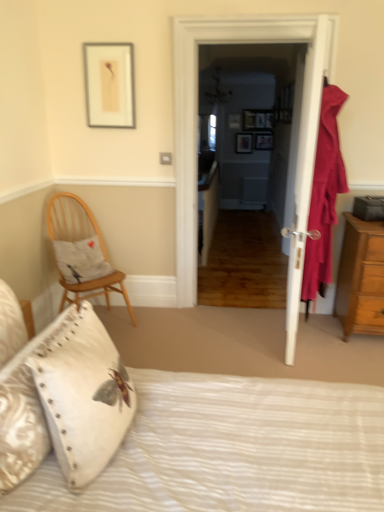
What is the approximate height of matte wooden picture frame at upper center, the 5th picture frame in the bottom-to-top sequence?

It is 32.72 centimeters.

This screenshot has height=512, width=384. What do you see at coordinates (196, 126) in the screenshot? I see `white wooden door at center` at bounding box center [196, 126].

Describe the element at coordinates (84, 397) in the screenshot. The image size is (384, 512). I see `velvet beige pillow at lower left, which is the 2th pillow in front-to-back order` at that location.

Find the location of a particular element. wooden chair with cushion at left is located at coordinates (81, 252).

Image resolution: width=384 pixels, height=512 pixels. What do you see at coordinates (324, 196) in the screenshot?
I see `velvet red curtain at right` at bounding box center [324, 196].

Where is `matte wooden picture frame at upper center, placed as the third picture frame when sorted from front to back`? Image resolution: width=384 pixels, height=512 pixels. matte wooden picture frame at upper center, placed as the third picture frame when sorted from front to back is located at coordinates (234, 121).

Between wooden chair with cushion at left and velvet red curtain at right, which one has less height?

With less height is wooden chair with cushion at left.

Considering their positions, is wooden chair with cushion at left located in front of or behind velvet red curtain at right?

wooden chair with cushion at left is behind velvet red curtain at right.

Is wooden chair with cushion at left surrounding velvet red curtain at right?

No, wooden chair with cushion at left does not contain velvet red curtain at right.

Does wooden chair with cushion at left turn towards velvet red curtain at right?

No, wooden chair with cushion at left is not oriented towards velvet red curtain at right.

Looking at this image, considering the positions of objects matte paper picture frame at upper left, the fifth picture frame viewed from the top, and white wooden door at center in the image provided, who is in front, matte paper picture frame at upper left, the fifth picture frame viewed from the top, or white wooden door at center?

white wooden door at center is closer to the camera.

Can you confirm if matte paper picture frame at upper left, which ranks as the first picture frame in bottom-to-top order, is wider than white wooden door at center?

No.

Is matte paper picture frame at upper left, which is the fifth picture frame in right-to-left order, facing away from white wooden door at center?

No, matte paper picture frame at upper left, which is the fifth picture frame in right-to-left order, is not facing the opposite direction of white wooden door at center.

From the image's perspective, which one is positioned higher, matte paper picture frame at upper left, the fifth picture frame viewed from the top, or white wooden door at center?

matte paper picture frame at upper left, the fifth picture frame viewed from the top.

Is white textured pillow at lower left, which appears as the third pillow when viewed from the back, positioned beyond the bounds of velvet red curtain at right?

white textured pillow at lower left, which appears as the third pillow when viewed from the back, is positioned outside velvet red curtain at right.

Does white textured pillow at lower left, the first pillow from the front, have a lesser height compared to velvet red curtain at right?

Yes, white textured pillow at lower left, the first pillow from the front, is shorter than velvet red curtain at right.

Is white textured pillow at lower left, the first pillow from the front, positioned with its back to velvet red curtain at right?

No, white textured pillow at lower left, the first pillow from the front,'s orientation is not away from velvet red curtain at right.

Is point (10, 384) positioned in front of point (322, 190)?

Yes, it is in front of point (322, 190).

Looking at their sizes, would you say white textured pillow at lower left, which appears as the third pillow when viewed from the back, is wider or thinner than matte paper picture frame at upper left, acting as the 1th picture frame starting from the left?

In the image, white textured pillow at lower left, which appears as the third pillow when viewed from the back, appears to be wider than matte paper picture frame at upper left, acting as the 1th picture frame starting from the left.

From a real-world perspective, is white textured pillow at lower left, the first pillow from the front, above or below matte paper picture frame at upper left, the first picture frame when ordered from front to back?

In terms of real-world spatial position, white textured pillow at lower left, the first pillow from the front, is below matte paper picture frame at upper left, the first picture frame when ordered from front to back.

The height and width of the screenshot is (512, 384). I want to click on the 2nd pillow directly beneath the matte paper picture frame at upper left, the first picture frame when ordered from front to back (from a real-world perspective), so click(x=25, y=409).

Is white textured pillow at lower left, the first pillow from the front, at the left side of matte paper picture frame at upper left, the fifth picture frame viewed from the top?

In fact, white textured pillow at lower left, the first pillow from the front, is to the right of matte paper picture frame at upper left, the fifth picture frame viewed from the top.

Looking at this image, which object is positioned more to the right, brown wooden chest of drawers at right or wooden picture frame at center, the first picture frame in the back-to-front sequence?

brown wooden chest of drawers at right.

Which is closer, (372, 248) or (239, 147)?

Point (372, 248) is closer to the camera than point (239, 147).

In terms of width, does brown wooden chest of drawers at right look wider or thinner when compared to wooden picture frame at center, the fifth picture frame viewed from the front?

Clearly, brown wooden chest of drawers at right has more width compared to wooden picture frame at center, the fifth picture frame viewed from the front.

Is velvet red curtain at right oriented towards white wooden door at center?

No, velvet red curtain at right is not oriented towards white wooden door at center.

Locate an element on the screen. This screenshot has height=512, width=384. curtain in front of the white wooden door at center is located at coordinates (324, 196).

From the image's perspective, is velvet red curtain at right located above or below white wooden door at center?

Based on their image positions, velvet red curtain at right is located beneath white wooden door at center.

Does point (304, 262) come farther from viewer compared to point (331, 53)?

Yes.

Which object is wider, white textured pillow at lower left, the first pillow from the front, or white cotton pillow at left, which is the 3th pillow from front to back?

Wider between the two is white cotton pillow at left, which is the 3th pillow from front to back.

Could you tell me if white textured pillow at lower left, the first pillow from the front, is facing white cotton pillow at left, which is the 3th pillow from front to back?

No, white textured pillow at lower left, the first pillow from the front, does not turn towards white cotton pillow at left, which is the 3th pillow from front to back.

From a real-world perspective, does white textured pillow at lower left, which appears as the third pillow when viewed from the back, sit lower than white cotton pillow at left, which is the 1th pillow in back-to-front order?

No.

Based on their positions, is white textured pillow at lower left, the first pillow from the front, located to the left or right of white cotton pillow at left, which is the 3th pillow from front to back?

white textured pillow at lower left, the first pillow from the front, is positioned on white cotton pillow at left, which is the 3th pillow from front to back,'s right side.

Identify the location of chair behind the velvet red curtain at right. The width and height of the screenshot is (384, 512). (81, 252).

I want to click on the 1st picture frame above the white wooden door at center (from the image's perspective), so click(x=109, y=84).

When comparing their distances from wooden picture frame at center, positioned as the fourth picture frame in front-to-back order, does wooden chair with cushion at left or brown wooden chest of drawers at right seem closer?

Among the two, brown wooden chest of drawers at right is located nearer to wooden picture frame at center, positioned as the fourth picture frame in front-to-back order.

Which object lies nearer to the anchor point matte wooden picture frame at upper center, placed as the third picture frame when sorted from front to back, white wooden door at center or wooden picture frame at center, which is the 4th picture frame from top to bottom?

The object closer to matte wooden picture frame at upper center, placed as the third picture frame when sorted from front to back, is wooden picture frame at center, which is the 4th picture frame from top to bottom.

Looking at the image, which one is located closer to white wooden door at center, velvet beige pillow at lower left, which is the 2th pillow in front-to-back order, or white textured bed at lower center?

white textured bed at lower center is closer to white wooden door at center.

Based on their spatial positions, is matte wooden picture frame at upper center, the 5th picture frame in the bottom-to-top sequence, or wooden chair with cushion at left closer to velvet beige pillow at lower left, which is the 2th pillow in front-to-back order?

wooden chair with cushion at left is positioned closer to the anchor velvet beige pillow at lower left, which is the 2th pillow in front-to-back order.

Estimate the real-world distances between objects in this image. Which object is closer to brown wooden chest of drawers at right, white textured bed at lower center or white textured pillow at lower left, the first pillow from the front?

white textured bed at lower center.

Looking at the image, which one is located closer to velvet beige pillow at lower left, placed as the second pillow when sorted from back to front, white textured bed at lower center or white textured pillow at lower left, which appears as the third pillow when viewed from the back?

Based on the image, white textured pillow at lower left, which appears as the third pillow when viewed from the back, appears to be nearer to velvet beige pillow at lower left, placed as the second pillow when sorted from back to front.

Estimate the real-world distances between objects in this image. Which object is further from wooden picture frame at center, the third picture frame from the bottom, velvet red curtain at right or matte wooden picture frame at upper center, which is counted as the fourth picture frame, starting from the right?

velvet red curtain at right is further to wooden picture frame at center, the third picture frame from the bottom.

Which object lies further to the anchor point brown wooden chest of drawers at right, wooden picture frame at center, which is the 4th picture frame from top to bottom, or matte wooden picture frame at upper center, which is counted as the fourth picture frame, starting from the right?

matte wooden picture frame at upper center, which is counted as the fourth picture frame, starting from the right.

You are a GUI agent. You are given a task and a screenshot of the screen. Output one action in this format:
    pyautogui.click(x=<x>, y=<y>)
    Task: Click on the chest of drawers between white textured bed at lower center and matte wooden picture frame at upper center, placed as the third picture frame when sorted from front to back, from front to back
    This screenshot has width=384, height=512.
    Given the screenshot: What is the action you would take?
    pyautogui.click(x=361, y=278)

Image resolution: width=384 pixels, height=512 pixels. Identify the location of picture frame between velvet beige pillow at lower left, which is the 2th pillow in front-to-back order, and wooden picture frame at upper center, which appears as the 2th picture frame when viewed from the right, from front to back. (109, 84).

Image resolution: width=384 pixels, height=512 pixels. Identify the location of pillow positioned between brown wooden chest of drawers at right and wooden picture frame at center, acting as the third picture frame starting from the left, from near to far. (81, 260).

The width and height of the screenshot is (384, 512). What are the coordinates of `door between white cotton pillow at left, which is the 3th pillow from front to back, and velvet red curtain at right from left to right` in the screenshot? It's located at (196, 126).